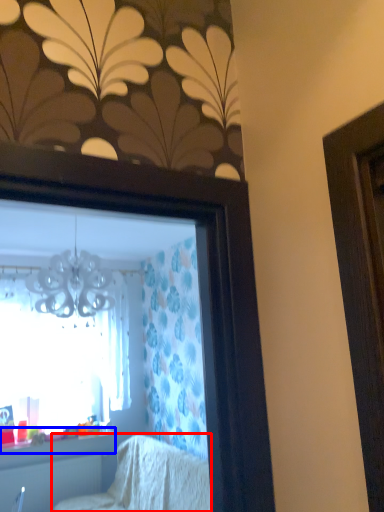
Question: Which object is closer to the camera taking this photo, furniture (highlighted by a red box) or window sill (highlighted by a blue box)?

Choices:
 (A) furniture
 (B) window sill

Answer: (A)